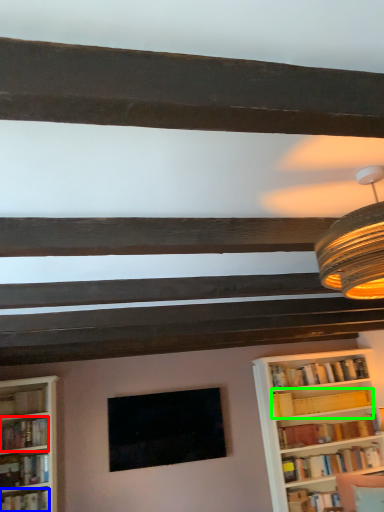
Question: Which object is positioned closest to book (highlighted by a red box)? Select from book (highlighted by a blue box) and book (highlighted by a green box).

Choices:
 (A) book
 (B) book

Answer: (A)